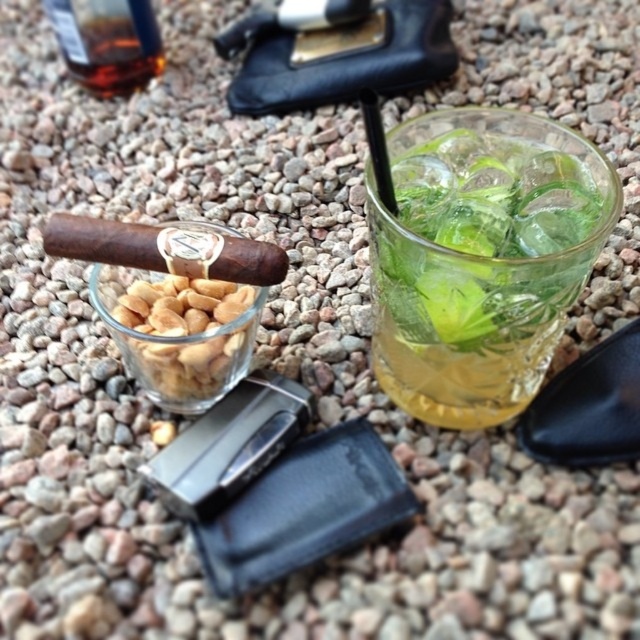
Based on the photo, you are at a picnic and want to pour liquid from the translucent glass bottle at upper left into the translucent glass peanuts at center. Is the bottle above or below the glass where you want to pour the liquid?

The translucent glass peanuts at center is below the translucent glass bottle at upper left, so the bottle is above the glass where you want to pour the liquid.

You are planning to place a decorative candle between the clear glass ice at upper right and the translucent glass peanuts at center. The candle is 4 inches wide. Can it fit between them without overlapping either?

The distance between the clear glass ice at upper right and the translucent glass peanuts at center is 7.37 inches. Since the candle is 4 inches wide, there is enough space to place it between them without overlapping either.